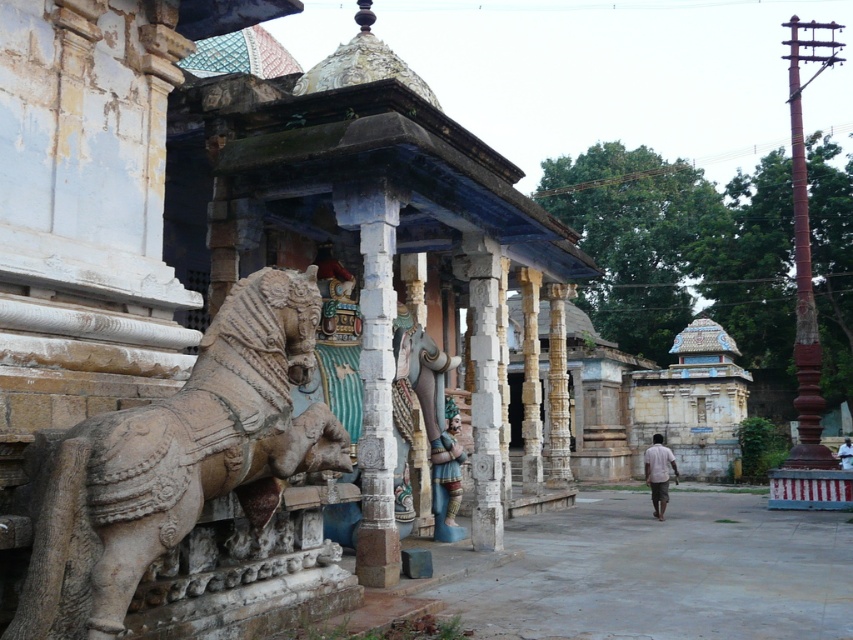
Who is more forward, (276, 470) or (440, 436)?

Point (276, 470)

Does stone carved horse at left have a greater width compared to polychrome painted statue at center?

Indeed, stone carved horse at left has a greater width compared to polychrome painted statue at center.

Consider the image. Who is more distant from viewer, (132, 545) or (434, 456)?

The point (434, 456) is more distant.

At what (x,y) coordinates should I click in order to perform the action: click on stone carved horse at left. Please return your answer as a coordinate pair (x, y). The width and height of the screenshot is (853, 640). Looking at the image, I should click on (175, 460).

Is white stone pillar at center wider than polished stone elephant at center?

No.

Which is below, white stone pillar at center or polished stone elephant at center?

polished stone elephant at center is lower down.

Which is behind, point (373, 444) or point (393, 384)?

Positioned behind is point (393, 384).

You are a GUI agent. You are given a task and a screenshot of the screen. Output one action in this format:
    pyautogui.click(x=<x>, y=<y>)
    Task: Click on the white stone pillar at center
    The image size is (853, 640).
    Given the screenshot: What is the action you would take?
    pyautogui.click(x=375, y=371)

Which of these two, white stone pillar at center or light brown cotton shirt at center, stands shorter?

Standing shorter between the two is light brown cotton shirt at center.

Between point (358, 224) and point (651, 456), which one is positioned in front?

Point (358, 224)

Which is in front, point (387, 497) or point (651, 460)?

Point (387, 497) is more forward.

The image size is (853, 640). In order to click on white stone pillar at center in this screenshot , I will do `click(375, 371)`.